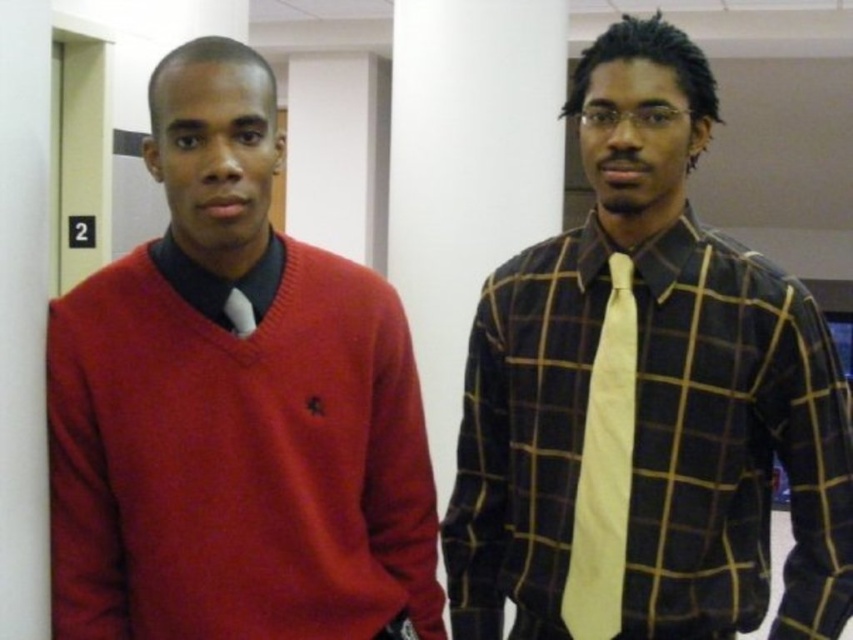
Question: Which point is closer to the camera taking this photo?

Choices:
 (A) (602, 572)
 (B) (107, 356)
 (C) (473, 493)

Answer: (B)

Question: Observing the image, what is the correct spatial positioning of matte red sweater at left in reference to yellow silk tie at right?

Choices:
 (A) right
 (B) left

Answer: (B)

Question: Which object is the farthest from the matte red sweater at left?

Choices:
 (A) plaid cotton shirt at center
 (B) yellow silk tie at right

Answer: (B)

Question: Can you confirm if matte red sweater at left is positioned to the left of yellow silk tie at right?

Choices:
 (A) yes
 (B) no

Answer: (A)

Question: Among these objects, which one is nearest to the camera?

Choices:
 (A) matte red sweater at left
 (B) yellow silk tie at right

Answer: (A)

Question: From the image, what is the correct spatial relationship of matte red sweater at left in relation to yellow silk tie at right?

Choices:
 (A) left
 (B) right

Answer: (A)